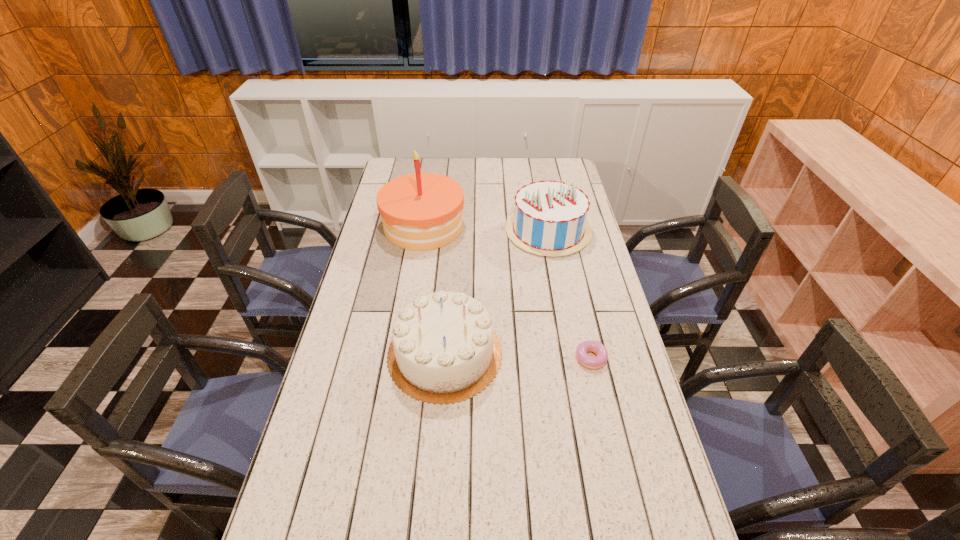
What are the coordinates of `unoccupied area between the shortest object and the nearest birthday cake` in the screenshot? It's located at (518, 357).

This screenshot has height=540, width=960. Identify the location of vacant area between the tallest object and the rightmost birthday cake. (486, 228).

This screenshot has height=540, width=960. I want to click on free point between the rightmost birthday cake and the nearest birthday cake, so click(x=496, y=292).

Find the location of a particular element. object that is the second closest one to the shortest object is located at coordinates (550, 219).

Locate which object is the closest to the tallest birthday cake. Please provide its 2D coordinates. Your answer should be formatted as a tuple, i.e. [(x, y)], where the tuple contains the x and y coordinates of a point satisfying the conditions above.

[(550, 219)]

Where is `birthday cake that stands as the second closest to the nearest birthday cake`? birthday cake that stands as the second closest to the nearest birthday cake is located at coordinates (422, 211).

I want to click on birthday cake that is the second nearest to the nearest birthday cake, so click(422, 211).

Identify the location of free location that satisfies the following two spatial constraints: 1. on the front side of the tallest birthday cake; 2. on the right side of the nearest birthday cake. (403, 354).

Image resolution: width=960 pixels, height=540 pixels. In order to click on vacant space that satisfies the following two spatial constraints: 1. on the front side of the shortest object; 2. on the left side of the rightmost birthday cake in this screenshot , I will do `click(572, 360)`.

You are a GUI agent. You are given a task and a screenshot of the screen. Output one action in this format:
    pyautogui.click(x=<x>, y=<y>)
    Task: Click on the vacant region that satisfies the following two spatial constraints: 1. on the back side of the nearest birthday cake; 2. on the left side of the rightmost birthday cake
    
    Given the screenshot: What is the action you would take?
    pyautogui.click(x=454, y=231)